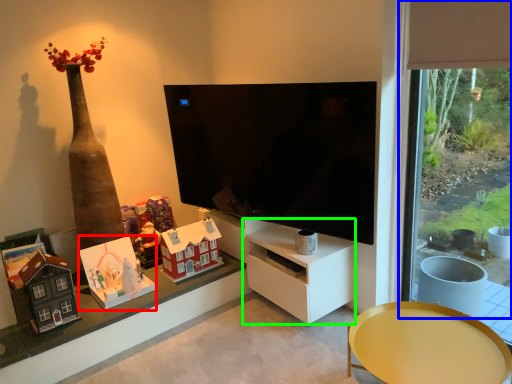
Question: Which is farther away from toy (highlighted by a red box)? window frame (highlighted by a blue box) or tv cabinet (highlighted by a green box)?

Choices:
 (A) window frame
 (B) tv cabinet

Answer: (A)